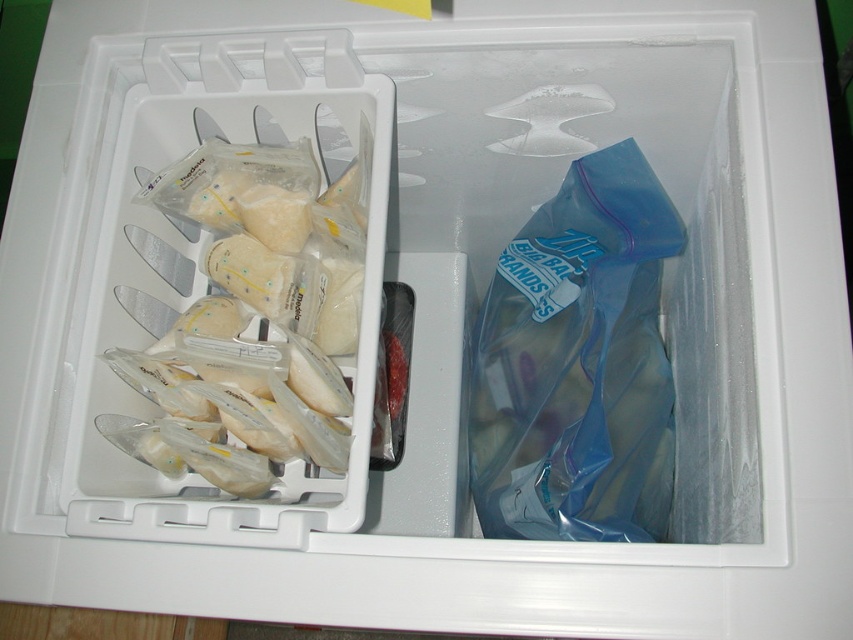
You are a parent trying to locate the breast milk storage bags in the left compartment of the container. You see a point at coordinate (578, 364). Is this point located on the transparent plastic bag in the right compartment?

The point at coordinate (578, 364) is on the transparent plastic bag at right, so yes, it is located on the transparent plastic bag in the right compartment.

You are organizing items in the freezer. You need to place a new item between the transparent plastic bag at right and the translucent plastic bags at left. Based on their current positions, where should you place the new item?

The transparent plastic bag at right is located below the translucent plastic bags at left, so you should place the new item between them by positioning it above the transparent plastic bag at right and below the translucent plastic bags at left.